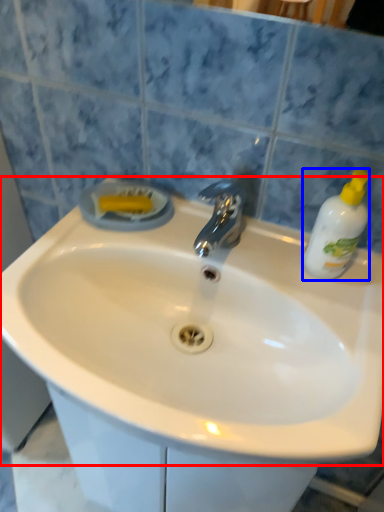
Question: Among these objects, which one is nearest to the camera, sink (highlighted by a red box) or cleaning product (highlighted by a blue box)?

Choices:
 (A) sink
 (B) cleaning product

Answer: (A)